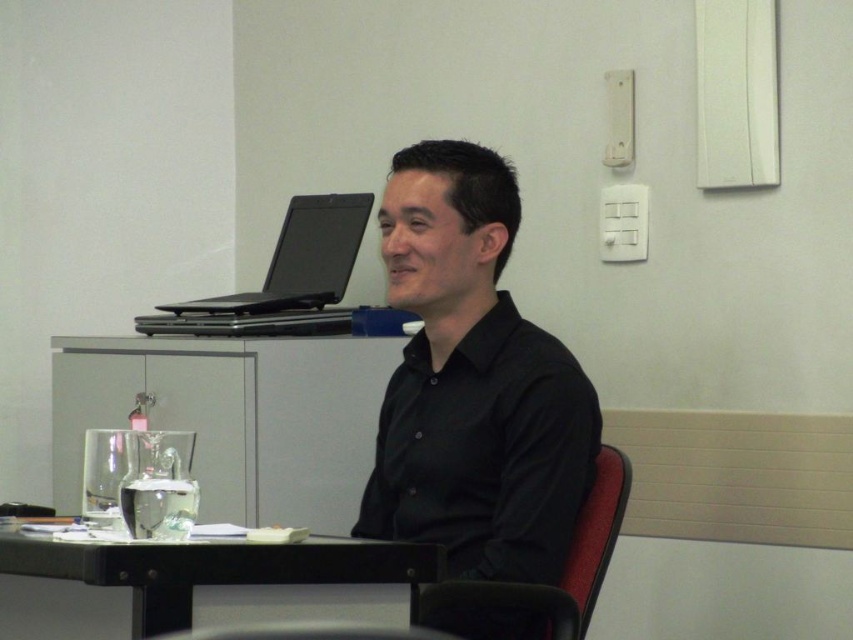
Between black matte shirt at center and fabric textured chair at center, which one appears on the left side from the viewer's perspective?

From the viewer's perspective, black matte shirt at center appears more on the left side.

Does black matte shirt at center appear over fabric textured chair at center?

Indeed, black matte shirt at center is positioned over fabric textured chair at center.

The height and width of the screenshot is (640, 853). In order to click on black matte shirt at center in this screenshot , I will do `click(473, 384)`.

Consider the image. Can you confirm if fabric textured chair at center is positioned to the right of black matte laptop at upper left?

Yes, fabric textured chair at center is to the right of black matte laptop at upper left.

Can you confirm if fabric textured chair at center is positioned below black matte laptop at upper left?

Indeed, fabric textured chair at center is positioned under black matte laptop at upper left.

Is point (602, 529) more distant than point (316, 209)?

No, it is in front of (316, 209).

Identify the location of fabric textured chair at center. The image size is (853, 640). (564, 570).

Which is above, black glossy table at lower left or fabric textured chair at center?

Positioned higher is black glossy table at lower left.

Is black glossy table at lower left taller than fabric textured chair at center?

No.

Does point (27, 576) lie in front of point (599, 465)?

That is True.

Find the location of a particular element. The image size is (853, 640). black glossy table at lower left is located at coordinates (199, 584).